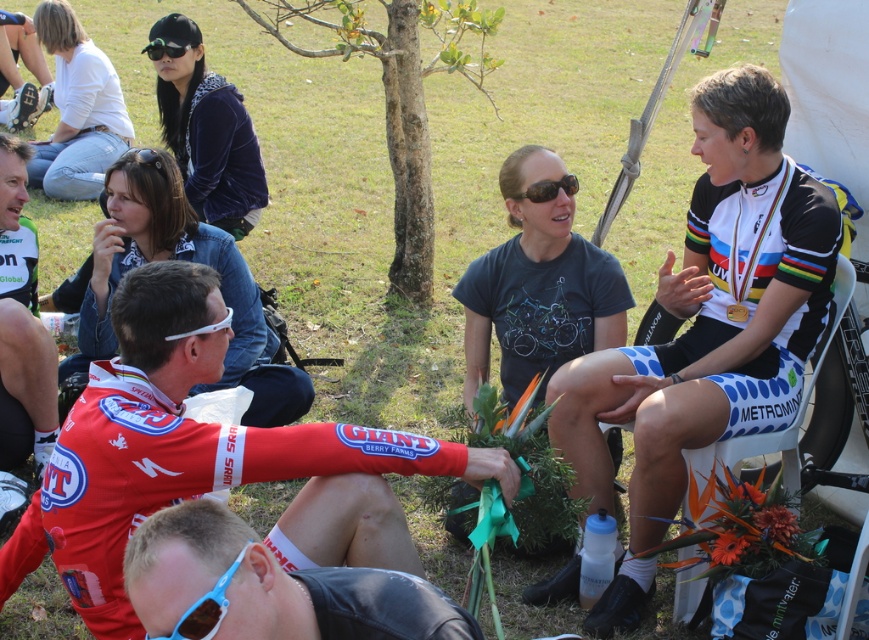
Question: Which point appears closest to the camera in this image?

Choices:
 (A) [x=8, y=403]
 (B) [x=793, y=432]
 (C) [x=544, y=193]

Answer: (B)

Question: Is matte green jersey at center positioned at the back of blue plastic sunglasses at lower left?

Choices:
 (A) yes
 (B) no

Answer: (A)

Question: Which object is farther from the camera taking this photo?

Choices:
 (A) red jersey at lower left
 (B) reddish-brown leather jacket at lower left

Answer: (A)

Question: Can you confirm if red jersey at lower left is positioned to the left of matte green jersey at center?

Choices:
 (A) yes
 (B) no

Answer: (B)

Question: Is red jersey at lower left above black matte goggles at upper center?

Choices:
 (A) no
 (B) yes

Answer: (A)

Question: Which point is closer to the camera?

Choices:
 (A) white plastic folding chair at right
 (B) white jersey at center
 (C) black matte goggles at upper center
 (D) black matte sunglasses at center

Answer: (B)